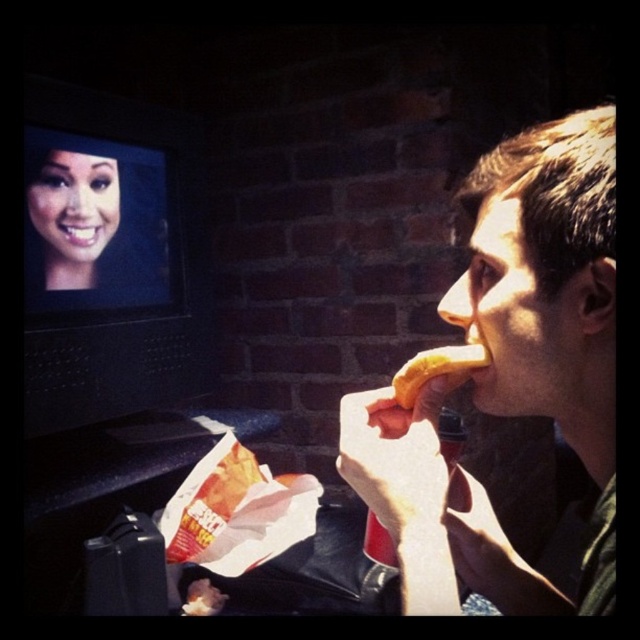
Based on the photo, is matte yellow hot dog at right to the right of smooth skin face at upper left from the viewer's perspective?

Yes, matte yellow hot dog at right is to the right of smooth skin face at upper left.

Which of these two, matte yellow hot dog at right or smooth skin face at upper left, stands shorter?

Standing shorter between the two is smooth skin face at upper left.

The height and width of the screenshot is (640, 640). What are the coordinates of `matte yellow hot dog at right` in the screenshot? It's located at (509, 372).

Is smooth skin face at upper left smaller than golden bread at mouth?

Incorrect, smooth skin face at upper left is not smaller in size than golden bread at mouth.

Can you confirm if smooth skin face at upper left is positioned to the left of golden bread at mouth?

Yes, smooth skin face at upper left is to the left of golden bread at mouth.

Does point (38, 218) lie behind point (406, 404)?

That is True.

The width and height of the screenshot is (640, 640). In order to click on smooth skin face at upper left in this screenshot , I will do `click(74, 216)`.

Based on the photo, is matte yellow hot dog at right thinner than golden bread at mouth?

Incorrect, matte yellow hot dog at right's width is not less than golden bread at mouth's.

Which is below, matte yellow hot dog at right or golden bread at mouth?

golden bread at mouth is lower down.

Find the location of a particular element. The width and height of the screenshot is (640, 640). matte yellow hot dog at right is located at coordinates (509, 372).